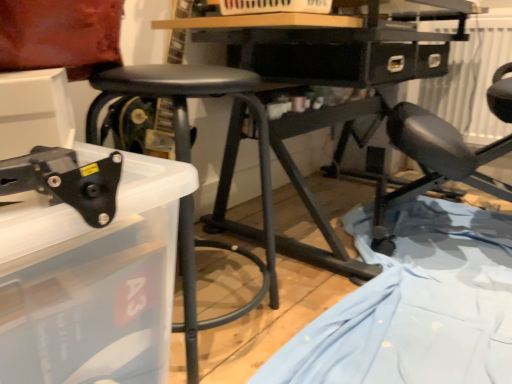
Question: Does black matte stool at center have a lesser height compared to black plastic tool at lower left?

Choices:
 (A) no
 (B) yes

Answer: (A)

Question: Considering the relative sizes of black matte stool at center and black plastic tool at lower left in the image provided, is black matte stool at center taller than black plastic tool at lower left?

Choices:
 (A) no
 (B) yes

Answer: (B)

Question: Can you confirm if black matte stool at center is smaller than black plastic tool at lower left?

Choices:
 (A) no
 (B) yes

Answer: (A)

Question: From a real-world perspective, is black matte stool at center located higher than black plastic tool at lower left?

Choices:
 (A) yes
 (B) no

Answer: (B)

Question: From a real-world perspective, is black matte stool at center below black plastic tool at lower left?

Choices:
 (A) no
 (B) yes

Answer: (B)

Question: Is matte black chair at right inside or outside of black plastic tool at lower left?

Choices:
 (A) outside
 (B) inside

Answer: (A)

Question: Based on their positions, is matte black chair at right located to the left or right of black plastic tool at lower left?

Choices:
 (A) left
 (B) right

Answer: (B)

Question: From the image's perspective, relative to black plastic tool at lower left, is matte black chair at right above or below?

Choices:
 (A) above
 (B) below

Answer: (A)

Question: Does point (421, 192) appear closer or farther from the camera than point (39, 170)?

Choices:
 (A) farther
 (B) closer

Answer: (A)

Question: In terms of size, does light blue fabric at lower right appear bigger or smaller than black matte stool at center?

Choices:
 (A) big
 (B) small

Answer: (B)

Question: In terms of height, does light blue fabric at lower right look taller or shorter compared to black matte stool at center?

Choices:
 (A) short
 (B) tall

Answer: (A)

Question: From a real-world perspective, is light blue fabric at lower right physically located above or below black matte stool at center?

Choices:
 (A) below
 (B) above

Answer: (A)

Question: Is point (410, 307) positioned closer to the camera than point (194, 76)?

Choices:
 (A) closer
 (B) farther

Answer: (B)

Question: Does point (375, 367) appear closer or farther from the camera than point (93, 167)?

Choices:
 (A) closer
 (B) farther

Answer: (B)

Question: Is light blue fabric at lower right bigger or smaller than black plastic tool at lower left?

Choices:
 (A) big
 (B) small

Answer: (A)